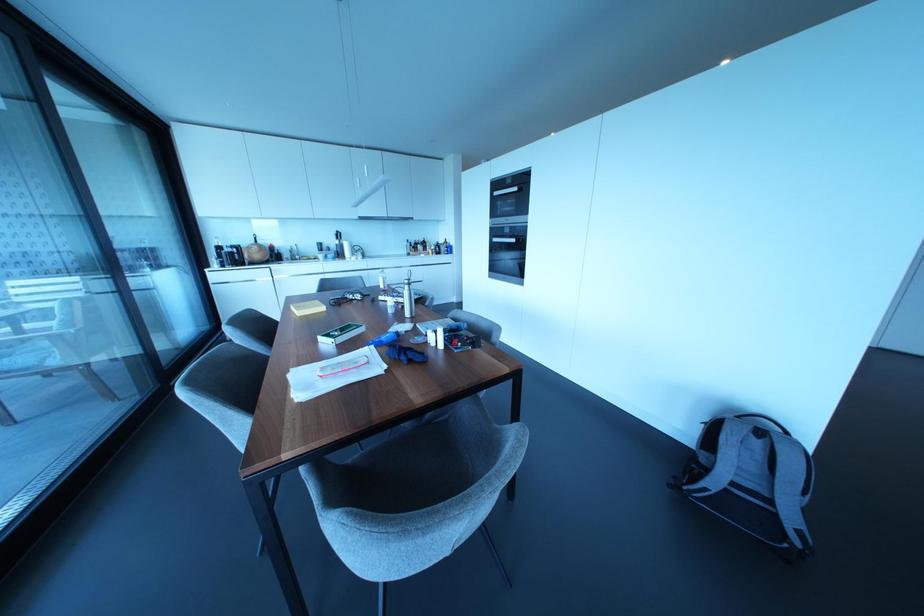
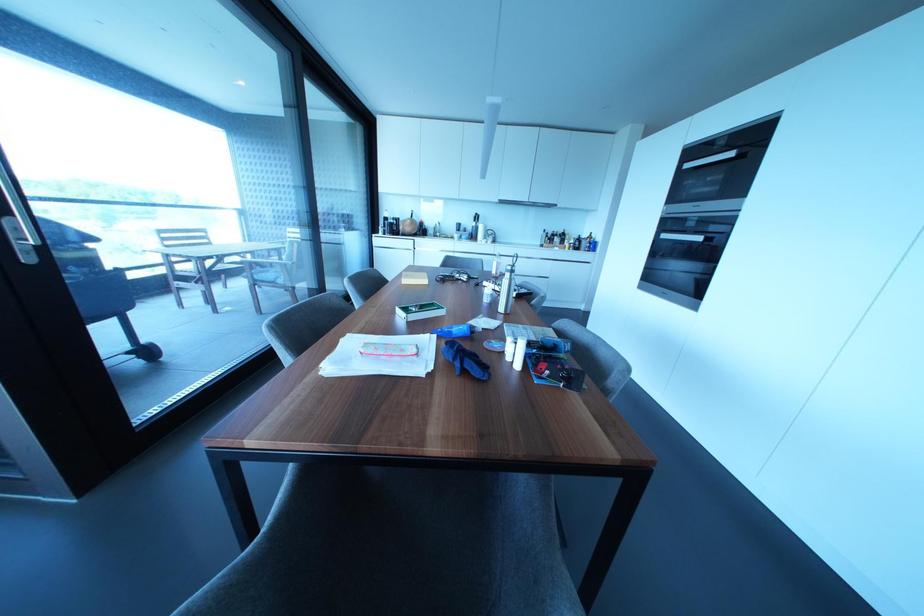
Question: The camera is either moving clockwise (left) or counter-clockwise (right) around the object. The first image is from the beginning of the video and the second image is from the end. Is the camera moving left or right when shooting the video?

Choices:
 (A) Left
 (B) Right

Answer: (B)